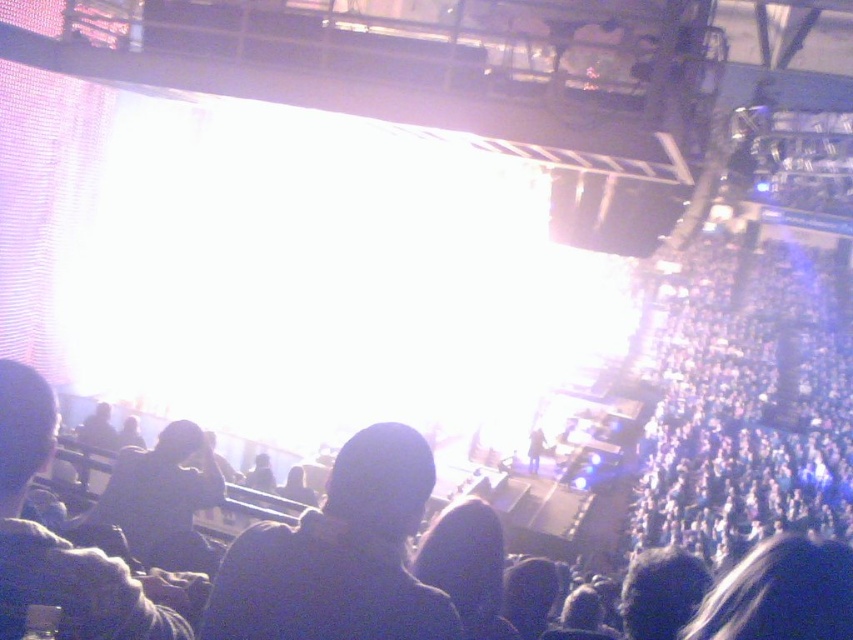
Which is in front, point (840, 513) or point (86, 566)?

Point (86, 566) is more forward.

Is point (846, 438) more distant than point (97, 625)?

Yes, point (846, 438) is farther from viewer.

Does point (724, 337) come behind point (54, 600)?

Yes, it is.

Find the location of `black matte crowd at center`. black matte crowd at center is located at coordinates (746, 406).

Which of these two, black matte crowd at center or dark fabric hat at center, stands shorter?

With less height is dark fabric hat at center.

Between point (743, 461) and point (297, 612), which one is positioned in front?

Point (297, 612)

Locate an element on the screen. black matte crowd at center is located at coordinates (746, 406).

Which of these two, dark fabric hat at center or dark fabric hat at left, stands shorter?

Standing shorter between the two is dark fabric hat at center.

Is dark fabric hat at center smaller than dark fabric hat at left?

Yes.

Who is more forward, (317, 596) or (140, 634)?

Point (317, 596) is more forward.

Locate an element on the screen. This screenshot has width=853, height=640. dark fabric hat at center is located at coordinates (339, 556).